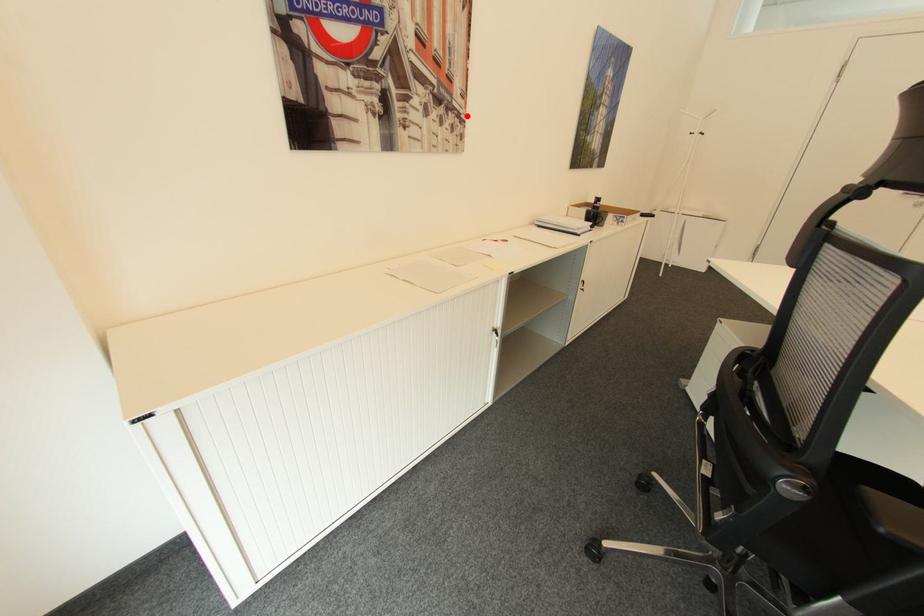
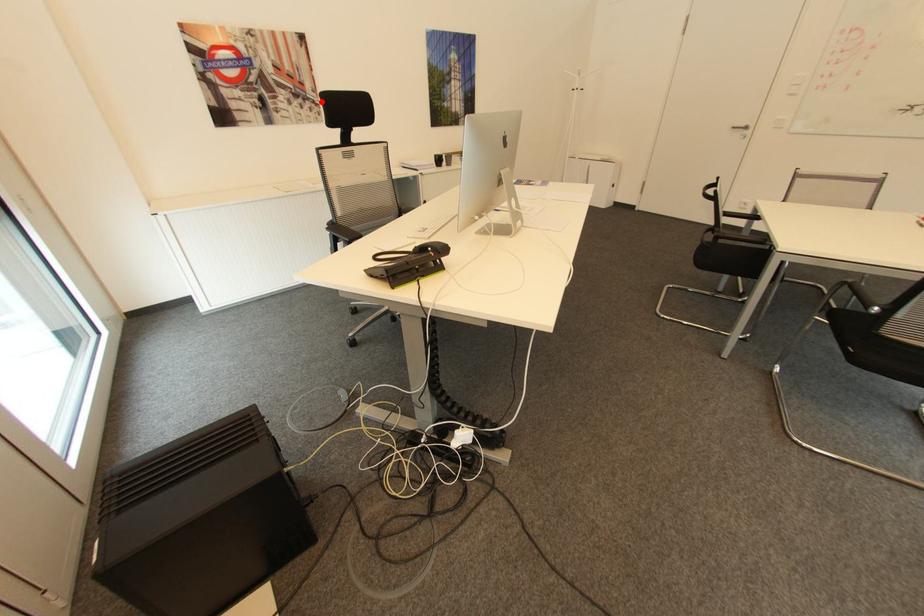
I am providing you with two images of the same scene from different viewpoints. A red point is marked on the first image and another point is marked on the second image. Does the point marked in image1 correspond to the same location as the one in image2?

Yes